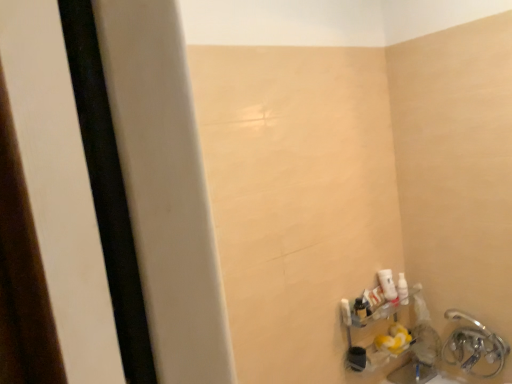
What do you see at coordinates (387, 284) in the screenshot? I see `white glossy lotion at lower right` at bounding box center [387, 284].

Locate an element on the screen. white glossy lotion at lower right is located at coordinates (387, 284).

Find the location of `silver metallic faucet at lower right`. silver metallic faucet at lower right is located at coordinates (473, 346).

What do you see at coordinates (473, 346) in the screenshot? I see `silver metallic faucet at lower right` at bounding box center [473, 346].

In order to click on white glossy lotion at lower right in this screenshot , I will do `click(387, 284)`.

Is white glossy lotion at lower right at the right side of silver metallic faucet at lower right?

Incorrect, white glossy lotion at lower right is not on the right side of silver metallic faucet at lower right.

Is the depth of white glossy lotion at lower right greater than that of silver metallic faucet at lower right?

That is True.

Is point (379, 274) positioned in front of point (478, 333)?

No, (379, 274) is behind (478, 333).

From the image's perspective, which is below, white glossy lotion at lower right or silver metallic faucet at lower right?

silver metallic faucet at lower right is shown below in the image.

From a real-world perspective, is white glossy lotion at lower right on silver metallic faucet at lower right?

Yes, from a real-world perspective, white glossy lotion at lower right is above silver metallic faucet at lower right.

Can you confirm if white glossy lotion at lower right is wider than silver metallic faucet at lower right?

Incorrect, the width of white glossy lotion at lower right does not surpass that of silver metallic faucet at lower right.

Who is shorter, white glossy lotion at lower right or silver metallic faucet at lower right?

With less height is white glossy lotion at lower right.

Considering the sizes of white glossy lotion at lower right and silver metallic faucet at lower right in the image, is white glossy lotion at lower right bigger or smaller than silver metallic faucet at lower right?

Clearly, white glossy lotion at lower right is smaller in size than silver metallic faucet at lower right.

Is white glossy lotion at lower right completely or partially outside of silver metallic faucet at lower right?

Yes, white glossy lotion at lower right is located beyond the bounds of silver metallic faucet at lower right.

Are white glossy lotion at lower right and silver metallic faucet at lower right located far from each other?

No, white glossy lotion at lower right is not far from silver metallic faucet at lower right.

Is silver metallic faucet at lower right at the back of white glossy lotion at lower right?

No, white glossy lotion at lower right's orientation is not away from silver metallic faucet at lower right.

The image size is (512, 384). Identify the location of toiletry that appears on the left of silver metallic faucet at lower right. (387, 284).

Is silver metallic faucet at lower right to the right of white glossy lotion at lower right from the viewer's perspective?

Yes, silver metallic faucet at lower right is to the right of white glossy lotion at lower right.

Considering their positions, is silver metallic faucet at lower right located in front of or behind white glossy lotion at lower right?

Visually, silver metallic faucet at lower right is located in front of white glossy lotion at lower right.

Between point (492, 374) and point (390, 294), which one is positioned in front?

The point (492, 374) is closer to the camera.

From the image's perspective, is silver metallic faucet at lower right located above or below white glossy lotion at lower right?

From the image's perspective, silver metallic faucet at lower right appears below white glossy lotion at lower right.

From a real-world perspective, does silver metallic faucet at lower right stand above white glossy lotion at lower right?

No, from a real-world perspective, silver metallic faucet at lower right is not on top of white glossy lotion at lower right.

Considering the relative sizes of silver metallic faucet at lower right and white glossy lotion at lower right in the image provided, is silver metallic faucet at lower right thinner than white glossy lotion at lower right?

Incorrect, the width of silver metallic faucet at lower right is not less than that of white glossy lotion at lower right.

Considering the relative sizes of silver metallic faucet at lower right and white glossy lotion at lower right in the image provided, is silver metallic faucet at lower right shorter than white glossy lotion at lower right?

No.

Which of these two, silver metallic faucet at lower right or white glossy lotion at lower right, is smaller?

Smaller between the two is white glossy lotion at lower right.

Is silver metallic faucet at lower right positioned beyond the bounds of white glossy lotion at lower right?

That's correct, silver metallic faucet at lower right is outside of white glossy lotion at lower right.

Is silver metallic faucet at lower right with white glossy lotion at lower right?

silver metallic faucet at lower right and white glossy lotion at lower right are not in contact.

Does silver metallic faucet at lower right turn towards white glossy lotion at lower right?

No, silver metallic faucet at lower right is not aimed at white glossy lotion at lower right.

How different are the orientations of silver metallic faucet at lower right and white glossy lotion at lower right in degrees?

They differ by 83.2 degrees in their facing directions.

There is a silver metallic faucet at lower right. Where is `toiletry above it (from a real-world perspective)`? This screenshot has width=512, height=384. toiletry above it (from a real-world perspective) is located at coordinates pyautogui.click(x=387, y=284).

In the image, there is a silver metallic faucet at lower right. In order to click on toiletry above it (from the image's perspective) in this screenshot , I will do `click(387, 284)`.

At what (x,y) coordinates should I click in order to perform the action: click on plumbing fixture on the right of white glossy lotion at lower right. Please return your answer as a coordinate pair (x, y). This screenshot has height=384, width=512. Looking at the image, I should click on (473, 346).